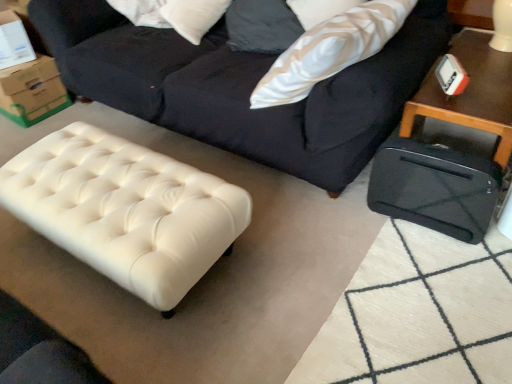
Question: Is the position of green cardboard box at upper left more distant than that of white textured pillow at upper right?

Choices:
 (A) yes
 (B) no

Answer: (A)

Question: Is there a large distance between green cardboard box at upper left and white textured pillow at upper right?

Choices:
 (A) yes
 (B) no

Answer: (A)

Question: Would you say green cardboard box at upper left contains white textured pillow at upper right?

Choices:
 (A) no
 (B) yes

Answer: (A)

Question: Does green cardboard box at upper left have a larger size compared to white textured pillow at upper right?

Choices:
 (A) yes
 (B) no

Answer: (B)

Question: From the image's perspective, is green cardboard box at upper left over white textured pillow at upper right?

Choices:
 (A) yes
 (B) no

Answer: (B)

Question: From a real-world perspective, is white textured pillow at upper right positioned above or below black plastic suitcase at right, arranged as the second table when viewed from the left?

Choices:
 (A) above
 (B) below

Answer: (A)

Question: Is white textured pillow at upper right spatially inside black plastic suitcase at right, arranged as the second table when viewed from the left, or outside of it?

Choices:
 (A) inside
 (B) outside

Answer: (B)

Question: From the image's perspective, is white textured pillow at upper right above or below black plastic suitcase at right, the 1th table when ordered from right to left?

Choices:
 (A) below
 (B) above

Answer: (B)

Question: Considering the positions of point (370, 18) and point (498, 119), is point (370, 18) closer or farther from the camera than point (498, 119)?

Choices:
 (A) closer
 (B) farther

Answer: (B)

Question: Looking at the image, does white textured pillow at upper right seem bigger or smaller compared to dark blue fabric studio couch at upper center?

Choices:
 (A) small
 (B) big

Answer: (A)

Question: Is white textured pillow at upper right taller or shorter than dark blue fabric studio couch at upper center?

Choices:
 (A) tall
 (B) short

Answer: (B)

Question: From the image's perspective, is white textured pillow at upper right located above or below dark blue fabric studio couch at upper center?

Choices:
 (A) above
 (B) below

Answer: (A)

Question: Is white textured pillow at upper right situated inside dark blue fabric studio couch at upper center or outside?

Choices:
 (A) inside
 (B) outside

Answer: (A)

Question: Looking at the image, does white leather ottoman at lower left, marked as the 1th table in a left-to-right arrangement, seem bigger or smaller compared to black plastic suitcase at right, the 1th table when ordered from right to left?

Choices:
 (A) big
 (B) small

Answer: (A)

Question: From a real-world perspective, relative to black plastic suitcase at right, arranged as the second table when viewed from the left, is white leather ottoman at lower left, marked as the 1th table in a left-to-right arrangement, vertically above or below?

Choices:
 (A) below
 (B) above

Answer: (A)